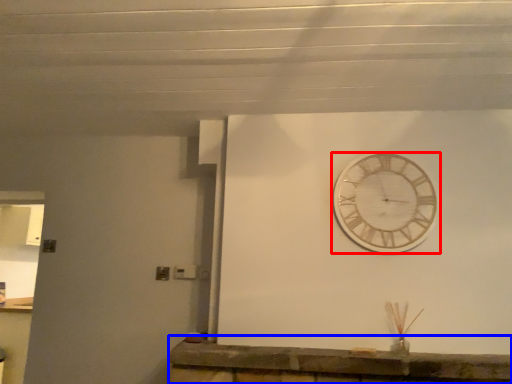
Question: Which object appears closest to the camera in this image, wall clock (highlighted by a red box) or counter (highlighted by a blue box)?

Choices:
 (A) wall clock
 (B) counter

Answer: (B)